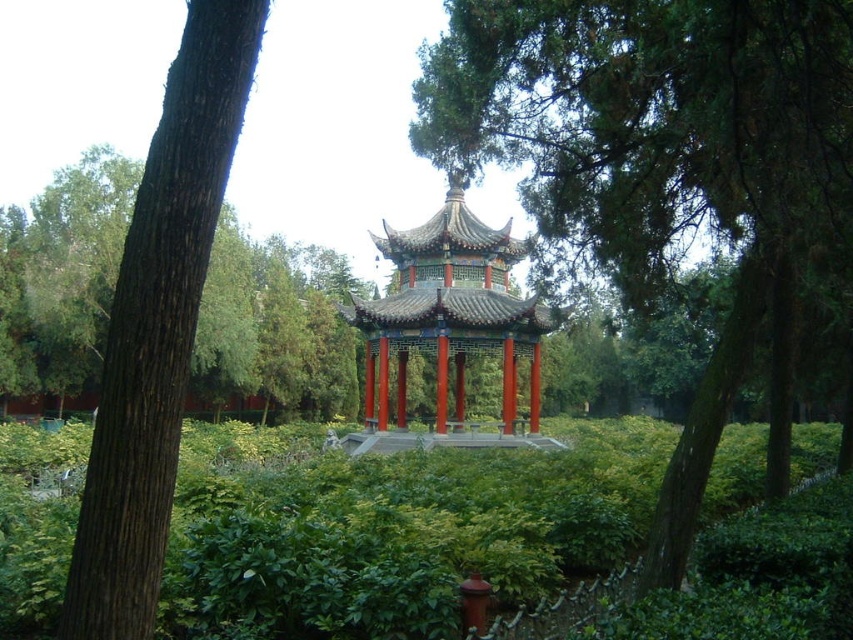
You are standing in the garden and want to walk from the pavilion to a specific location. You have two points to choose from, point (x=138, y=506) and point (x=531, y=420). Which point is closer to you if you are facing the pavilion?

Point (x=138, y=506) is closer to the viewer than point (x=531, y=420), so you should choose point (x=138, y=506) as it is nearer when facing the pavilion.